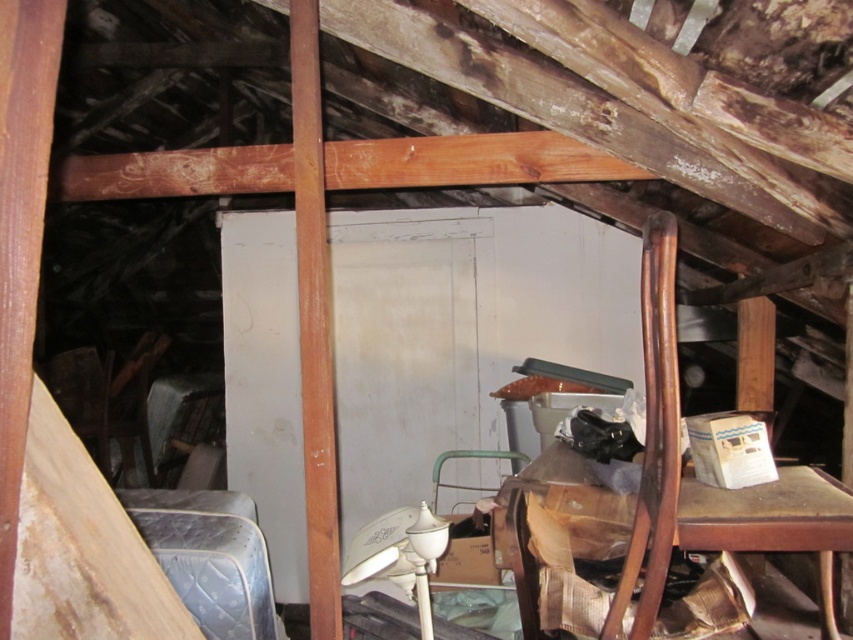
Can you confirm if wooden chair at center is positioned below blue quilted mattress at lower left?

No, wooden chair at center is not below blue quilted mattress at lower left.

Which is below, wooden chair at center or blue quilted mattress at lower left?

blue quilted mattress at lower left is below.

At what (x,y) coordinates should I click in order to perform the action: click on wooden chair at center. Please return your answer as a coordinate pair (x, y). Looking at the image, I should click on (680, 468).

What do you see at coordinates (314, 323) in the screenshot?
I see `smooth wooden beam at center` at bounding box center [314, 323].

Between smooth wooden beam at center and blue quilted mattress at lower left, which one appears on the left side from the viewer's perspective?

blue quilted mattress at lower left is more to the left.

Who is more distant from viewer, (328, 282) or (195, 605)?

The point (328, 282) is more distant.

Where is `smooth wooden beam at center`? The height and width of the screenshot is (640, 853). smooth wooden beam at center is located at coordinates (314, 323).

Which is below, wooden chair at center or smooth wooden beam at center?

wooden chair at center

Is wooden chair at center below smooth wooden beam at center?

Correct, wooden chair at center is located below smooth wooden beam at center.

At what (x,y) coordinates should I click in order to perform the action: click on wooden chair at center. Please return your answer as a coordinate pair (x, y). Looking at the image, I should click on (680, 468).